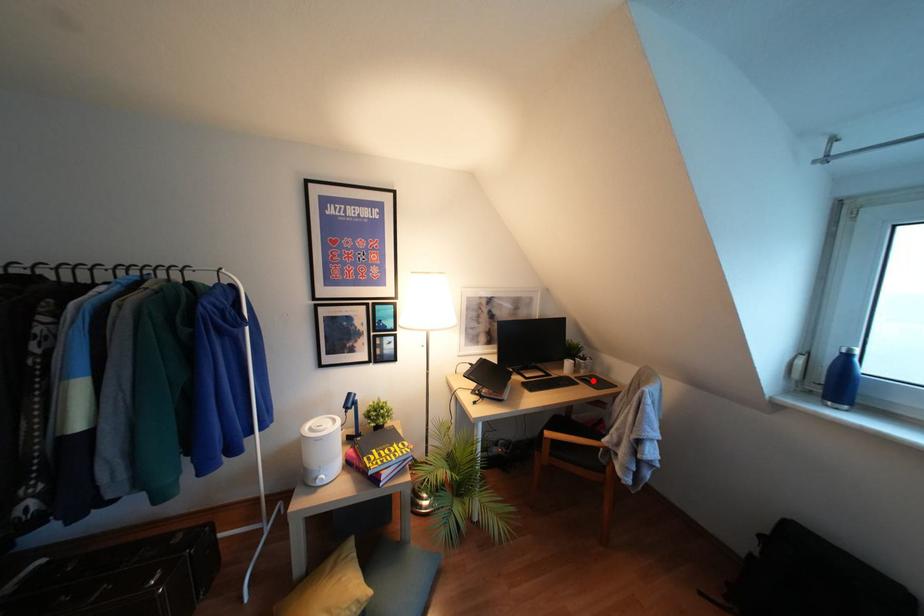
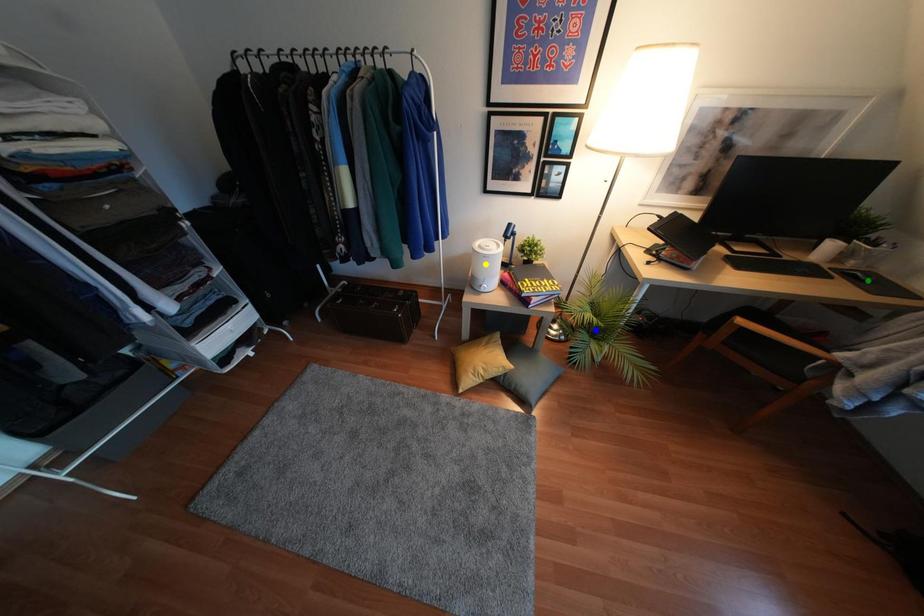
Question: I am providing you with two images of the same scene from different viewpoints. A red point is marked on the first image. You are given multiple points on the second image. Which spot in image 2 lines up with the point in image 1?

Choices:
 (A) blue point
 (B) yellow point
 (C) green point

Answer: (C)